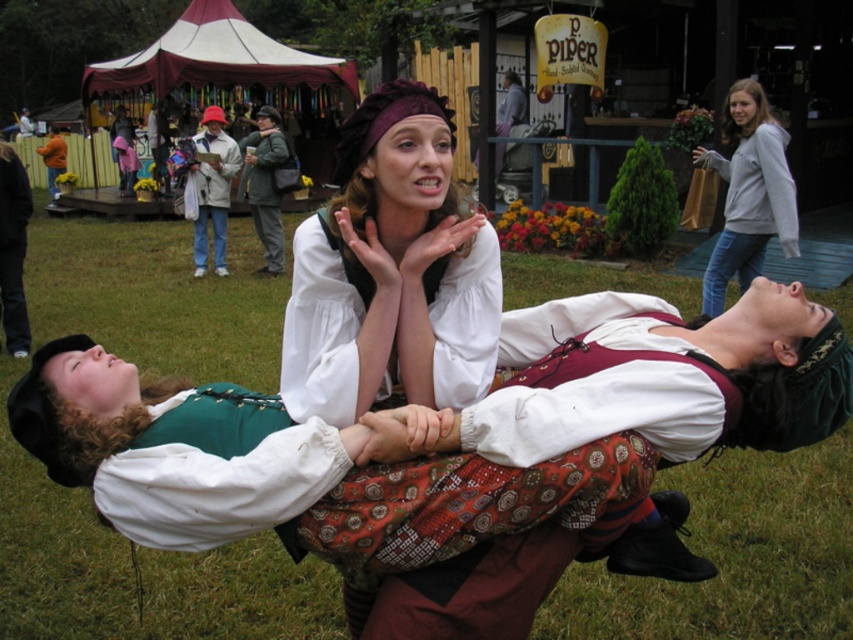
Is point (479, 371) closer to viewer compared to point (21, 262)?

Yes, it is in front of point (21, 262).

Can you confirm if white cotton blouse at center is smaller than black fabric pants at left?

Yes.

Is point (302, 294) positioned before point (10, 156)?

That is True.

You are a GUI agent. You are given a task and a screenshot of the screen. Output one action in this format:
    pyautogui.click(x=<x>, y=<y>)
    Task: Click on the white cotton blouse at center
    
    Given the screenshot: What is the action you would take?
    pyautogui.click(x=318, y=332)

Who is taller, white cotton blouse at center or white cotton coat at center?

Standing taller between the two is white cotton coat at center.

Is white cotton blouse at center thinner than white cotton coat at center?

Yes, white cotton blouse at center is thinner than white cotton coat at center.

This screenshot has width=853, height=640. I want to click on white cotton blouse at center, so click(318, 332).

Is gray fleece sweatshirt at upper right above white cotton coat at center?

No, gray fleece sweatshirt at upper right is not above white cotton coat at center.

Is gray fleece sweatshirt at upper right thinner than white cotton coat at center?

Incorrect, gray fleece sweatshirt at upper right's width is not less than white cotton coat at center's.

The width and height of the screenshot is (853, 640). What are the coordinates of `gray fleece sweatshirt at upper right` in the screenshot? It's located at (747, 193).